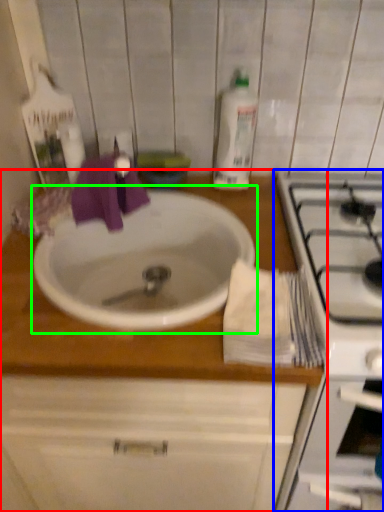
Question: Which is farther away from countertop (highlighted by a red box)? appliance (highlighted by a blue box) or sink (highlighted by a green box)?

Choices:
 (A) appliance
 (B) sink

Answer: (A)